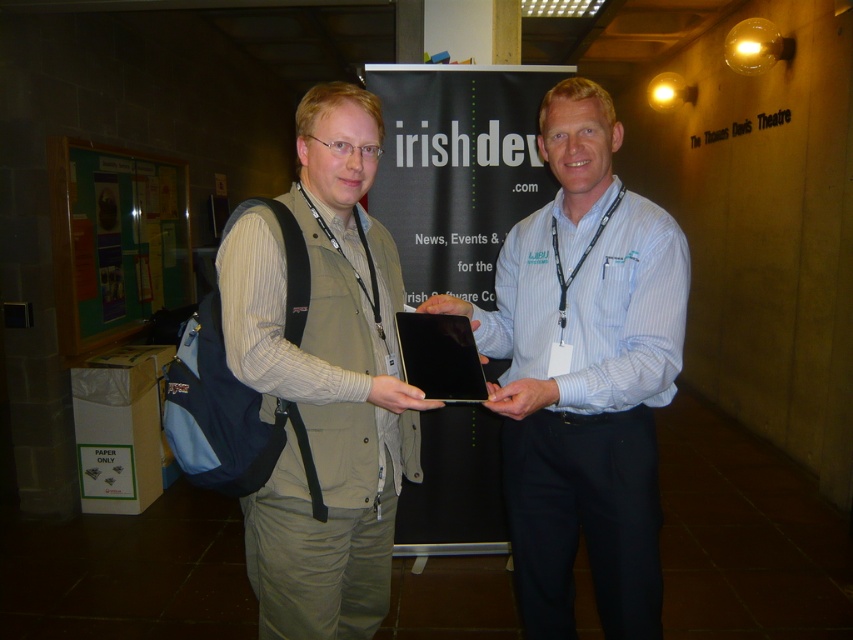
You are at the conference and want to take a photo of the banner. You notice two points on the banner at coordinates point (560, 577) and point (321, 128). Which point is closer to the camera?

Point (321, 128) is closer to the camera than point (560, 577) because the description states that point (560, 577) is further away.

You are an event organizer who needs to identify the presenter wearing the light blue striped shirt at center and the matte khaki vest at center. Based on their clothing layers, which one is visible on top?

The light blue striped shirt at center is positioned over the matte khaki vest at center, so the light blue striped shirt at center is visible on top.